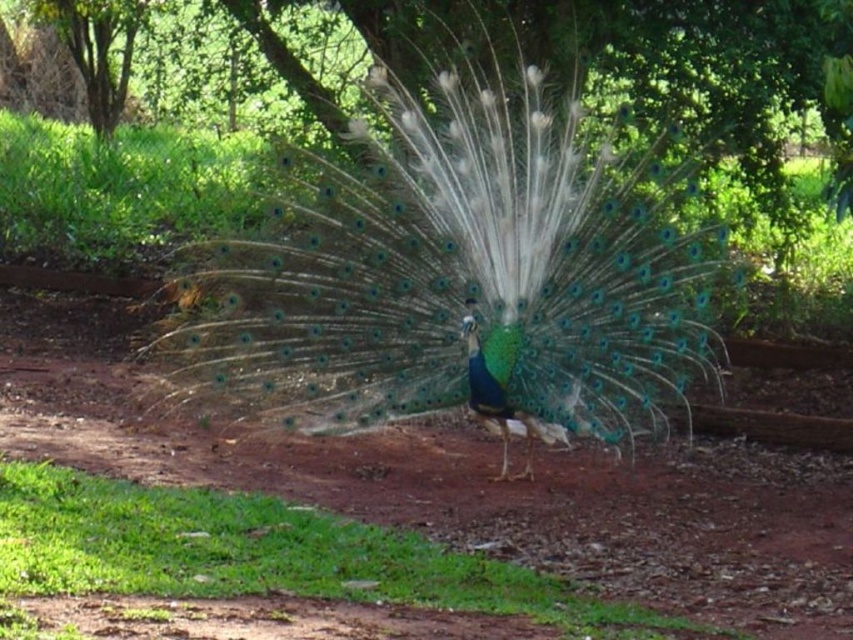
Is shiny iridescent peacock at center closer to camera compared to green grass at lower left?

No, it is behind green grass at lower left.

Is shiny iridescent peacock at center below green grass at lower left?

Actually, shiny iridescent peacock at center is above green grass at lower left.

Where is `shiny iridescent peacock at center`? The height and width of the screenshot is (640, 853). shiny iridescent peacock at center is located at coordinates (460, 276).